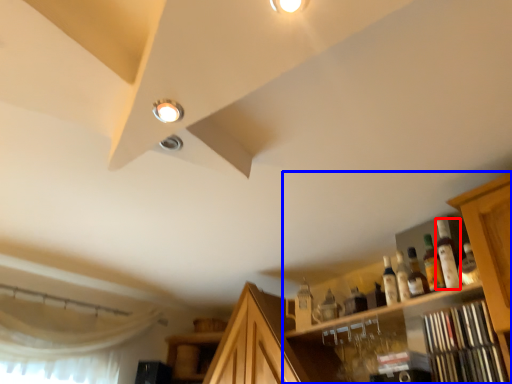
Question: Which object appears closest to the camera in this image, bottle (highlighted by a red box) or cabinetry (highlighted by a blue box)?

Choices:
 (A) bottle
 (B) cabinetry

Answer: (B)